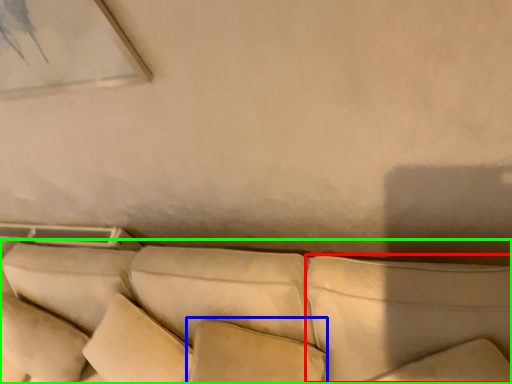
Question: Estimate the real-world distances between objects in this image. Which object is farther from pillow (highlighted by a red box), pillow (highlighted by a blue box) or studio couch (highlighted by a green box)?

Choices:
 (A) pillow
 (B) studio couch

Answer: (A)